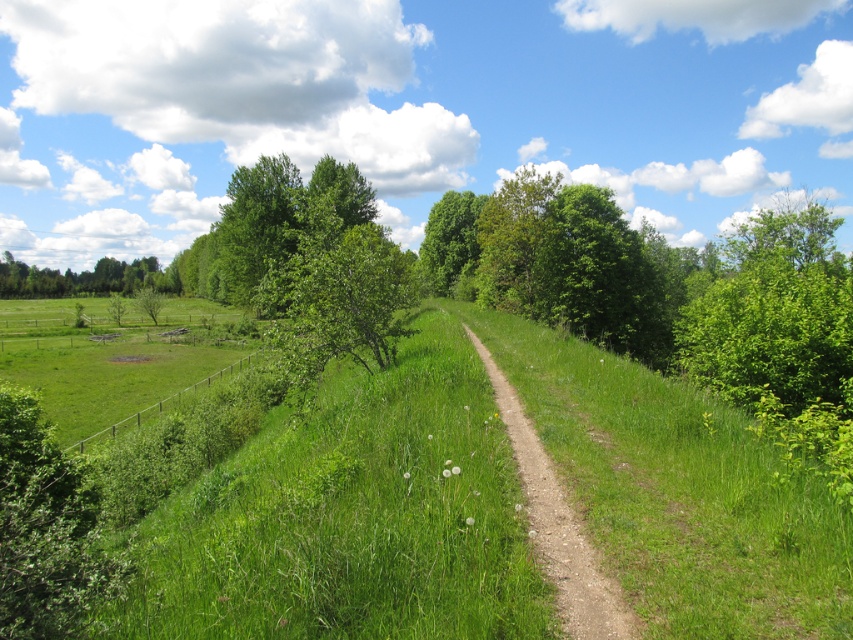
Question: Does dirt path at center come behind green leafy tree at left?

Choices:
 (A) no
 (B) yes

Answer: (A)

Question: Where is dirt path at center located in relation to green leafy tree at left in the image?

Choices:
 (A) right
 (B) left

Answer: (A)

Question: Among these points, which one is farthest from the camera?

Choices:
 (A) (161, 289)
 (B) (28, 429)
 (C) (440, 268)
 (D) (500, 419)

Answer: (A)

Question: Estimate the real-world distances between objects in this image. Which object is closer to the green leafy tree at left?

Choices:
 (A) green leafy shrub at lower left
 (B) dirt path at center

Answer: (A)

Question: Is green leafy shrub at lower left smaller than green leafy tree at center?

Choices:
 (A) yes
 (B) no

Answer: (A)

Question: Which object appears closest to the camera in this image?

Choices:
 (A) green leafy tree at center
 (B) green leafy tree at left

Answer: (A)